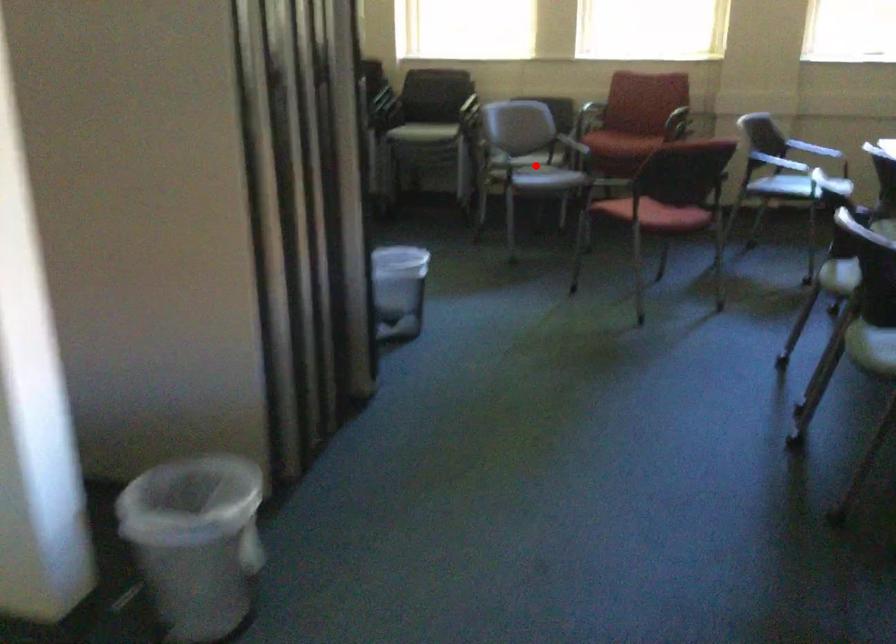
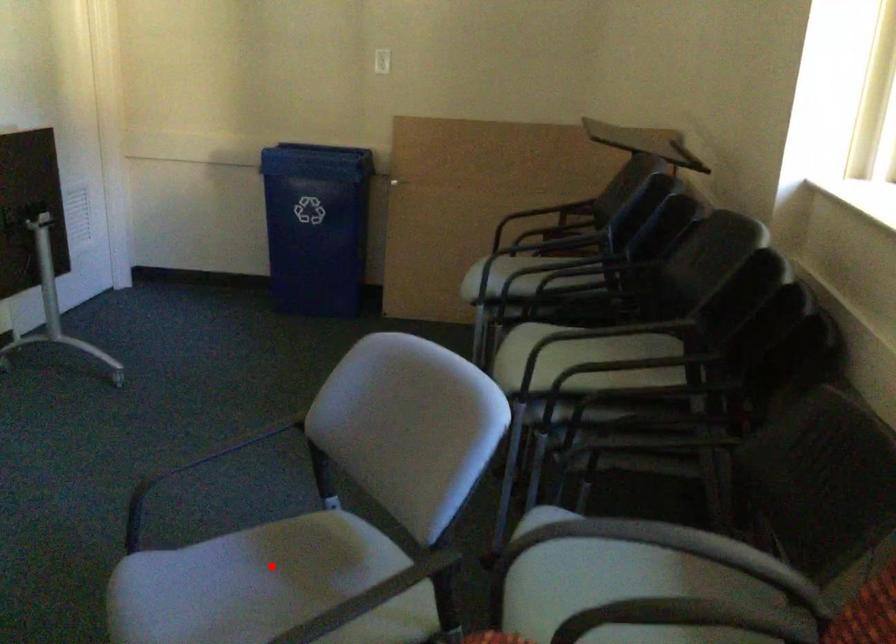
I am providing you with two images of the same scene from different viewpoints. A red point is marked on the first image and another point is marked on the second image. Is the red point in image1 aligned with the point shown in image2?

Yes